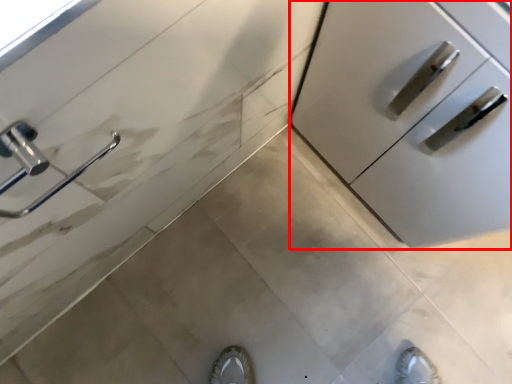
Question: From the image's perspective, what is the correct spatial relationship of cabinetry (annotated by the red box) in relation to door handle?

Choices:
 (A) below
 (B) above

Answer: (B)